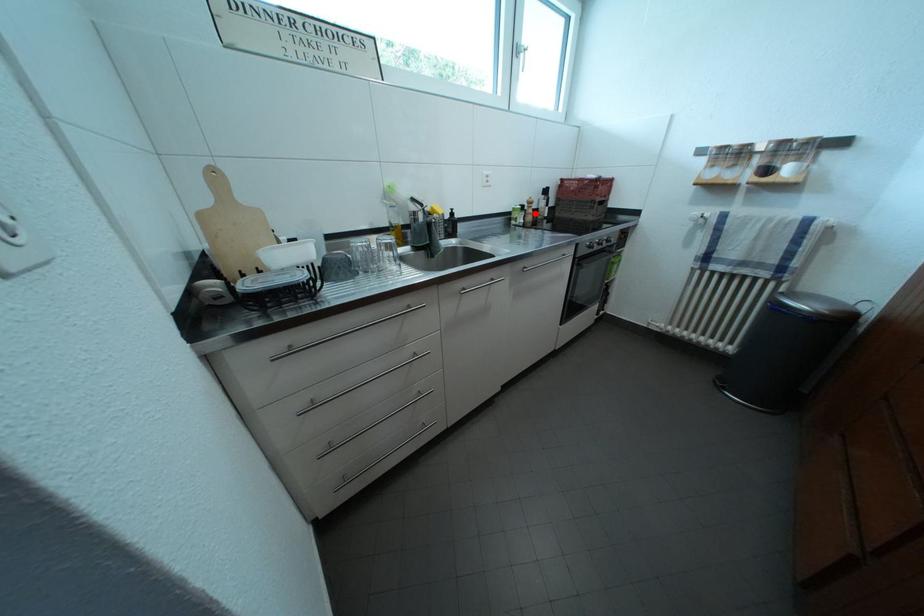
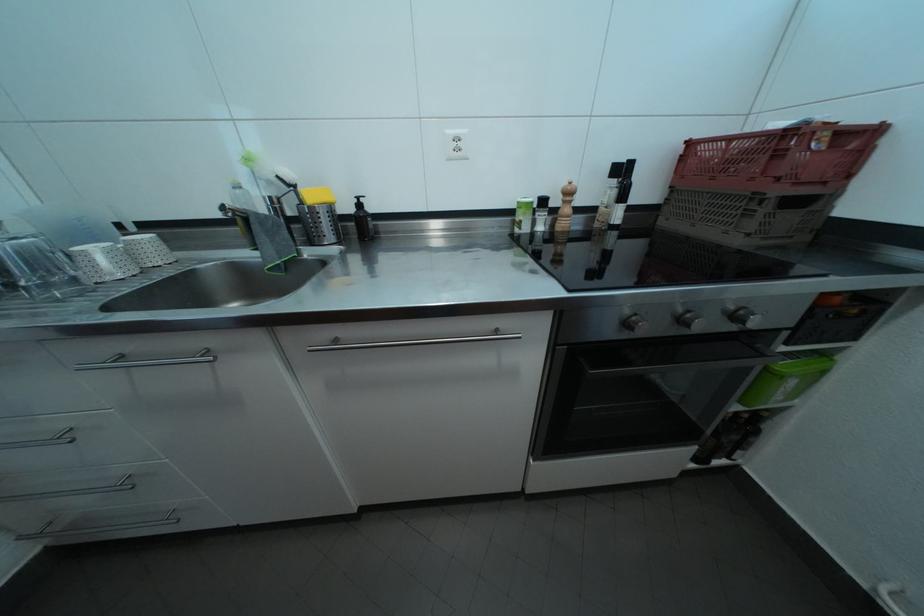
Find the pixel in the second image that matches the highlighted location in the first image.

(564, 208)